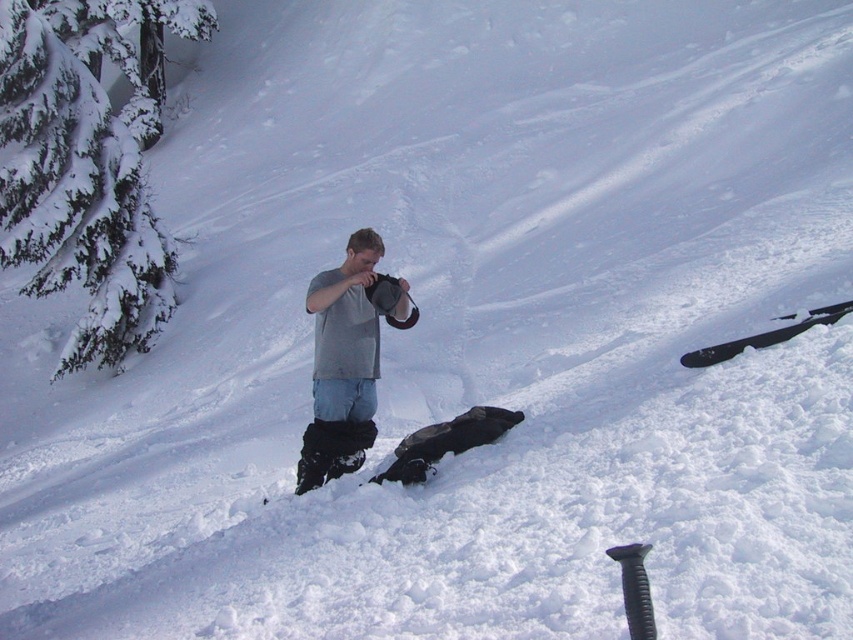
You are standing in the snowy mountain area and want to take a photo of the green textured pine at upper left. Where should you position yourself to capture it in the frame?

The green textured pine at upper left is located at point [78,179], so you should position yourself to the left side of the frame to capture it in the photo.

You are planning to take a photo of the green textured pine at upper left and the gray fabric snowboard at center. Which object should you zoom in more on to capture both in the frame without moving your camera?

You should zoom in more on the gray fabric snowboard at center because the green textured pine at upper left has a lesser width compared to it, so adjusting focus to the wider object ensures both fit in the frame.